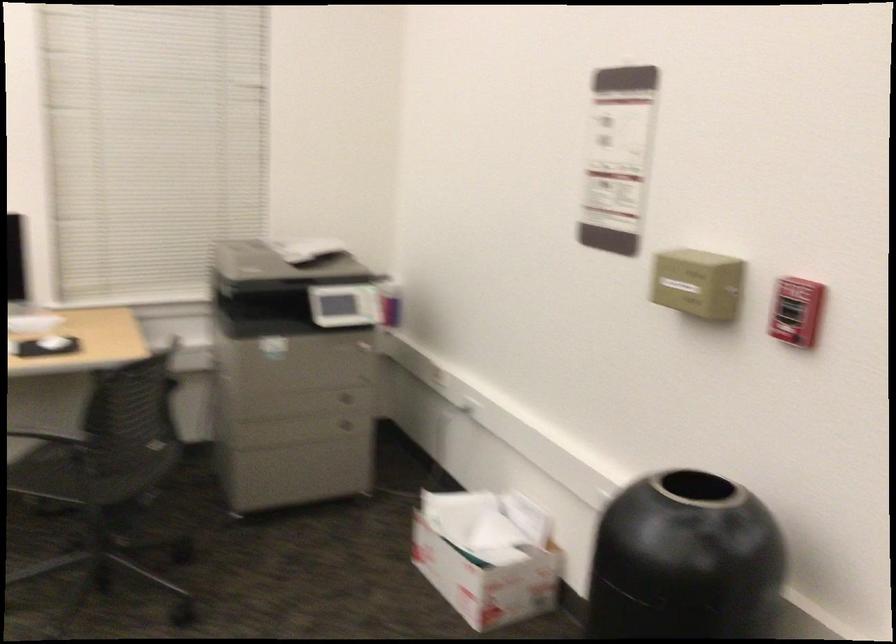
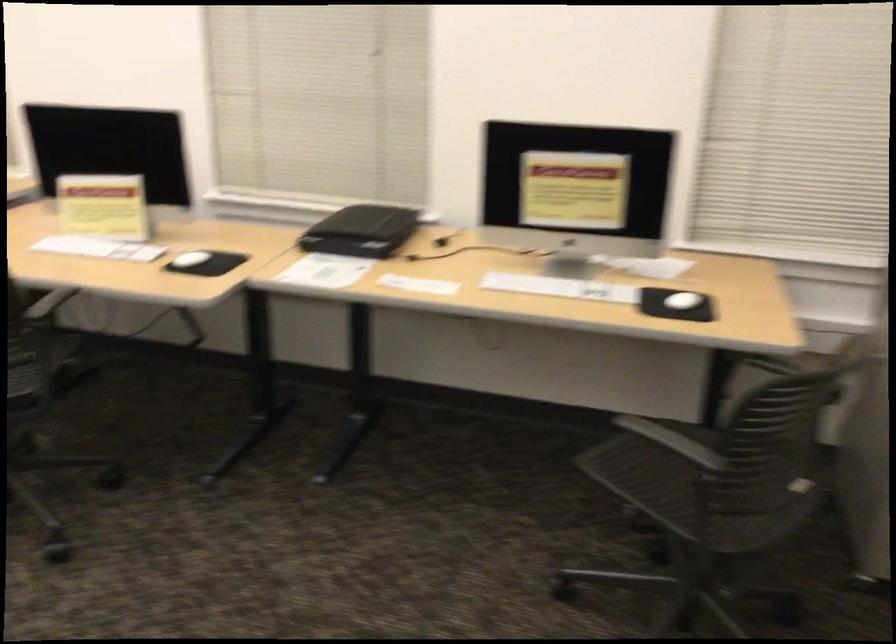
Question: The images are taken continuously from a first-person perspective. In which direction is your viewpoint rotating?

Choices:
 (A) Left
 (B) Right
 (C) Up
 (D) Down

Answer: (A)